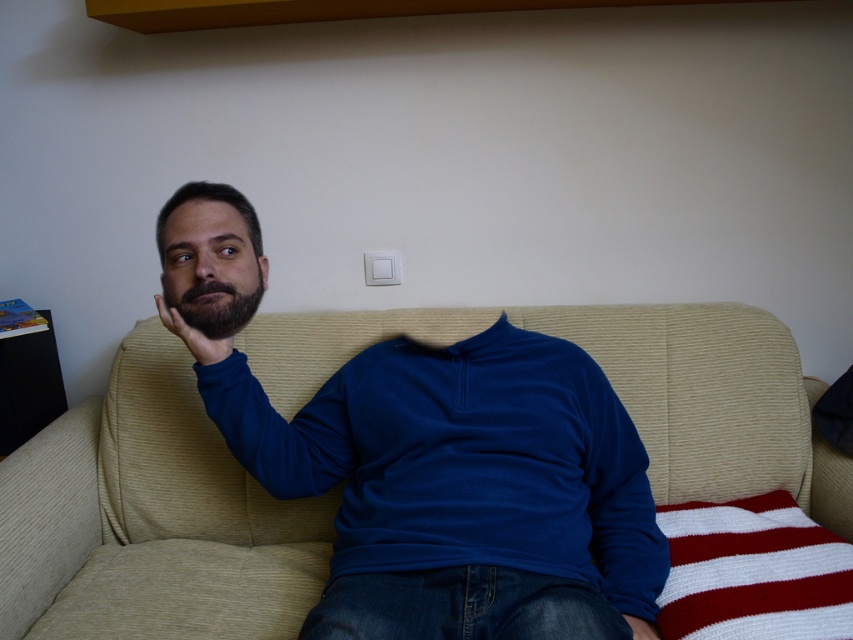
Question: Is blue cotton shirt at center bigger than matte skin hand at center?

Choices:
 (A) no
 (B) yes

Answer: (B)

Question: Can you confirm if matte skin hand at center is thinner than white plastic light switch at upper center?

Choices:
 (A) no
 (B) yes

Answer: (A)

Question: Which point is farther to the camera?

Choices:
 (A) blue cotton shirt at center
 (B) white plastic light switch at upper center
 (C) beige corduroy couch at center
 (D) matte skin hand at center

Answer: (B)

Question: Among these points, which one is farthest from the camera?

Choices:
 (A) (386, 273)
 (B) (177, 330)

Answer: (A)

Question: Which object is positioned closest to the matte skin hand at center?

Choices:
 (A) white plastic light switch at upper center
 (B) beige corduroy couch at center
 (C) blue cotton shirt at center

Answer: (C)

Question: Is beige corduroy couch at center in front of white plastic light switch at upper center?

Choices:
 (A) yes
 (B) no

Answer: (A)